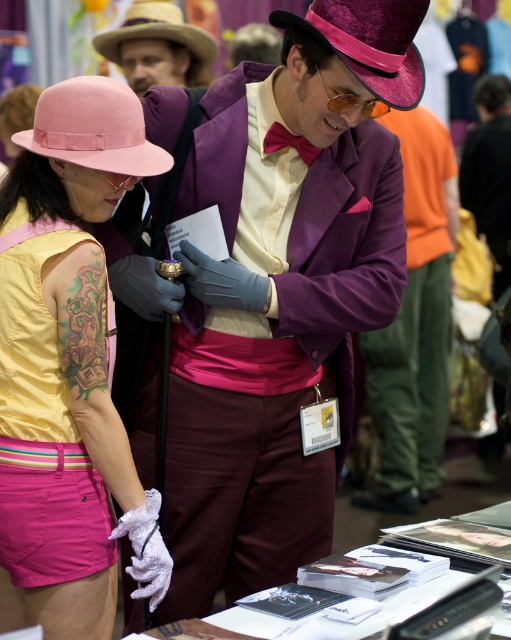
You are a photographer at the event and need to capture both the purple satin suit at center and the purple velvet cowboy hat at upper center in a single frame. Given that your camera has a fixed focal length, which object should you position closer to the camera to ensure both fit in the frame?

Since the purple satin suit at center is larger in size than the purple velvet cowboy hat at upper center, you should position the purple velvet cowboy hat at upper center closer to the camera. This way, the smaller object can be magnified to match the size of the larger one in the frame.

You are taking a photo of two points in the scene. The first point is at coordinate point (x=42, y=477) and the second is at point (x=450, y=300). Which point will appear larger in your photo?

Point (x=42, y=477) is closer to the camera than point (x=450, y=300), so it will appear larger in the photo.